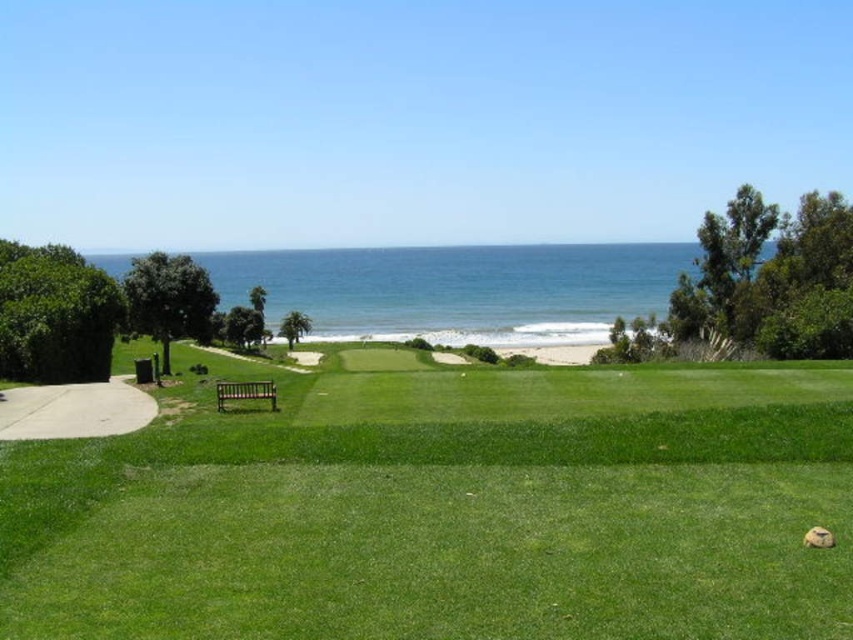
You are standing at the point with coordinates point (140, 428) and want to walk towards the ocean. Is the point (624, 547) blocking your path?

Point (624, 547) is in front of point (140, 428), so yes, the point (624, 547) is blocking your path.